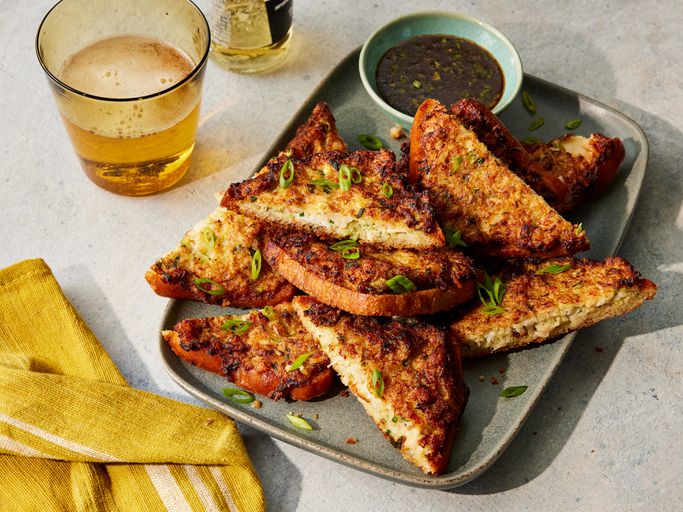
Locate an element on the screen. dish for the sauce is located at coordinates (363, 66).